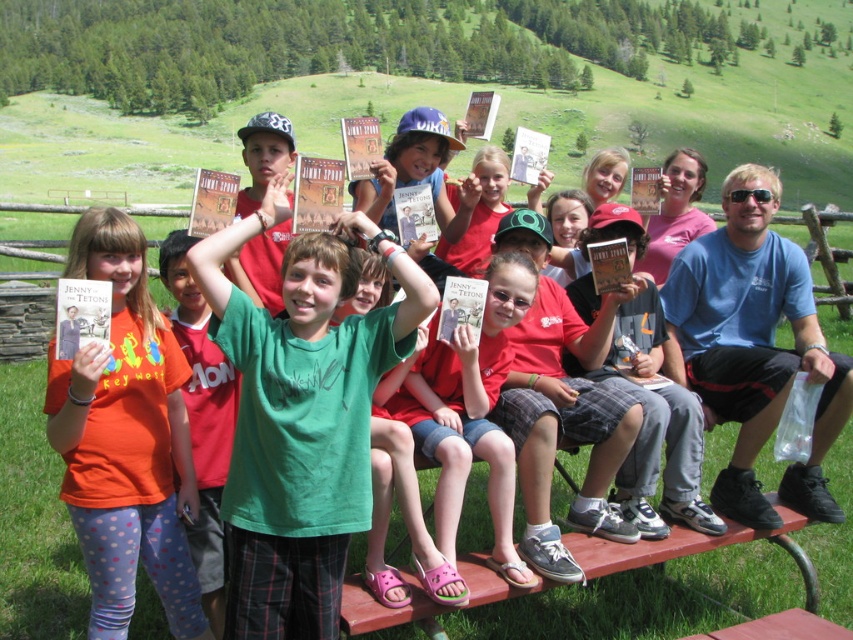
Question: Does green cotton shirt at center appear over matte orange t-shirt at center?

Choices:
 (A) no
 (B) yes

Answer: (B)

Question: Is green cotton shirt at center wider than pink fabric shorts at center?

Choices:
 (A) no
 (B) yes

Answer: (B)

Question: Considering the real-world distances, which object is farthest from the green cotton shirt at center?

Choices:
 (A) matte orange t-shirt at center
 (B) pink fabric shorts at center

Answer: (B)

Question: Where is matte orange t-shirt at center located in relation to pink fabric shorts at center in the image?

Choices:
 (A) right
 (B) left

Answer: (B)

Question: Which of the following is the farthest from the observer?

Choices:
 (A) (461, 474)
 (B) (93, 564)

Answer: (A)

Question: Which of the following is the closest to the observer?

Choices:
 (A) green cotton shirt at center
 (B) matte orange t-shirt at center

Answer: (B)